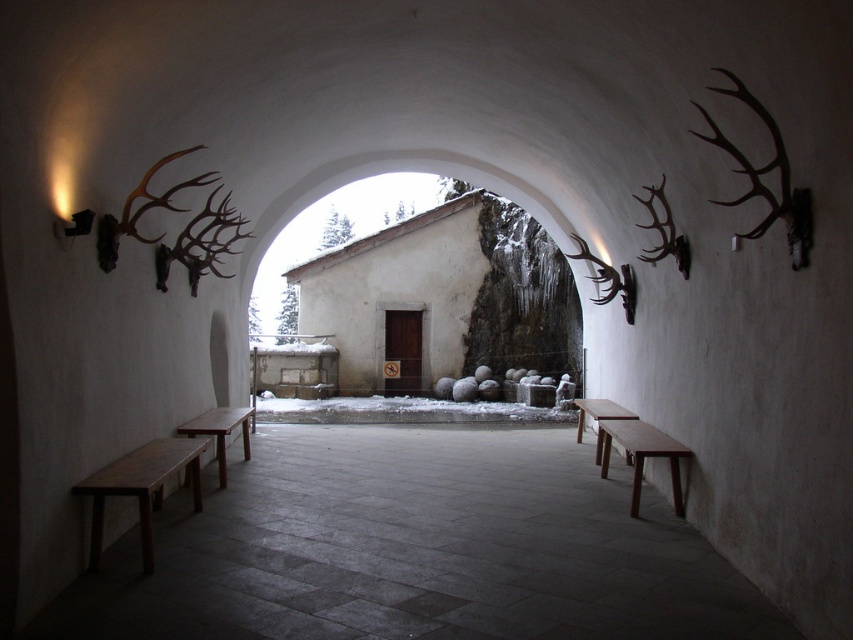
At what (x,y) coordinates should I click in order to perform the action: click on smooth wooden bench at center. Please return your answer as a coordinate pair (x, y). Looking at the image, I should click on (415, 548).

Does smooth wooden bench at center appear on the left side of wooden bench at left?

Incorrect, smooth wooden bench at center is not on the left side of wooden bench at left.

Who is more forward, [114,595] or [128,452]?

Point [114,595] is more forward.

Image resolution: width=853 pixels, height=640 pixels. I want to click on smooth wooden bench at center, so click(x=415, y=548).

Is wooden bench at left taller than brown wooden bench at center?

No, wooden bench at left is not taller than brown wooden bench at center.

Does wooden bench at left appear under brown wooden bench at center?

Incorrect, wooden bench at left is not positioned below brown wooden bench at center.

Is point (196, 476) farther from viewer compared to point (619, 417)?

No.

The image size is (853, 640). What are the coordinates of `wooden bench at left` in the screenshot? It's located at (141, 486).

Is point (224, 410) positioned behind point (596, 444)?

No, it is not.

From the picture: Which is below, wooden bench at center or brown wooden bench at center?

brown wooden bench at center

Where is `wooden bench at center`? The image size is (853, 640). wooden bench at center is located at coordinates (219, 432).